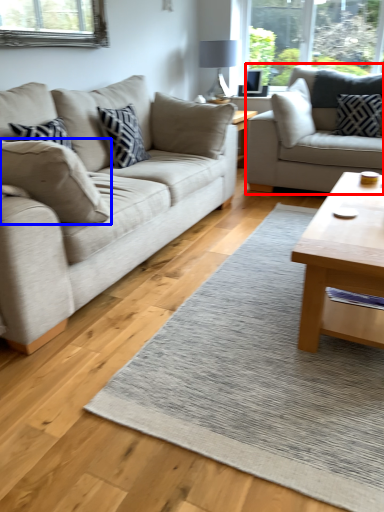
Question: Among these objects, which one is nearest to the camera, studio couch (highlighted by a red box) or pillow (highlighted by a blue box)?

Choices:
 (A) studio couch
 (B) pillow

Answer: (B)